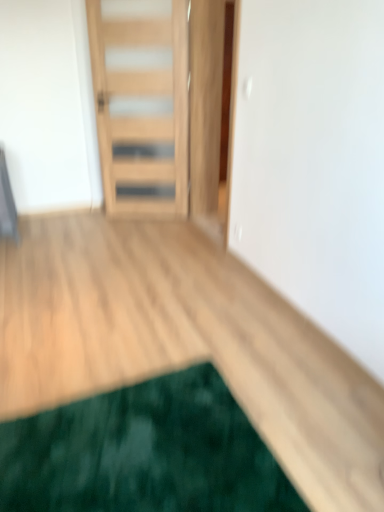
The width and height of the screenshot is (384, 512). Find the location of `vacant space underneath natural wood door at center (from a real-world perspective)`. vacant space underneath natural wood door at center (from a real-world perspective) is located at coordinates (152, 215).